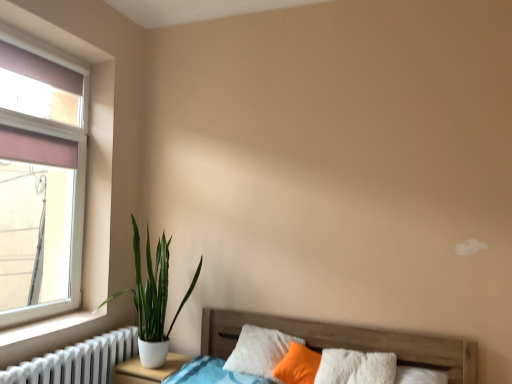
Where is `white ceramic plant at left`? This screenshot has width=512, height=384. white ceramic plant at left is located at coordinates (154, 300).

What are the coordinates of `white metallic radiator at lower left` in the screenshot? It's located at (77, 361).

What do you see at coordinates (347, 341) in the screenshot?
I see `wooden bed at lower left` at bounding box center [347, 341].

This screenshot has height=384, width=512. I want to click on wooden bed at lower left, so [347, 341].

What do you see at coordinates (46, 326) in the screenshot? The height and width of the screenshot is (384, 512). I see `white smooth window sill at lower left` at bounding box center [46, 326].

Where is `white ceramic plant at left`? The image size is (512, 384). white ceramic plant at left is located at coordinates (154, 300).

Is white metallic radiator at lower left oriented away from transparent glass window at left?

No.

Is white metallic radiator at lower left positioned behind transparent glass window at left?

That is False.

Based on the photo, how many degrees apart are the facing directions of white metallic radiator at lower left and transparent glass window at left?

white metallic radiator at lower left and transparent glass window at left are facing 88.9 degrees away from each other.

From a real-world perspective, is white metallic radiator at lower left positioned under transparent glass window at left based on gravity?

Indeed, from a real-world perspective, white metallic radiator at lower left is positioned beneath transparent glass window at left.

Considering the points (258, 365) and (7, 91), which point is in front, point (258, 365) or point (7, 91)?

The point (7, 91) is in front.

Can you confirm if white fluffy pillow at lower center is smaller than transparent glass window at left?

No, white fluffy pillow at lower center is not smaller than transparent glass window at left.

The width and height of the screenshot is (512, 384). In order to click on window above the white fluffy pillow at lower center (from a real-world perspective) in this screenshot , I will do `click(47, 165)`.

Considering the relative positions of white fluffy pillow at lower center and transparent glass window at left in the image provided, is white fluffy pillow at lower center to the left or to the right of transparent glass window at left?

Based on their positions, white fluffy pillow at lower center is located to the right of transparent glass window at left.

Consider the image. Can you confirm if white metallic radiator at lower left is positioned to the left of white smooth window sill at lower left?

No.

Looking at this image, is white metallic radiator at lower left behind white smooth window sill at lower left?

No, white metallic radiator at lower left is in front of white smooth window sill at lower left.

Considering the relative sizes of white metallic radiator at lower left and white smooth window sill at lower left in the image provided, is white metallic radiator at lower left wider than white smooth window sill at lower left?

Yes, white metallic radiator at lower left is wider than white smooth window sill at lower left.

In terms of size, does white matte nightstand at lower left appear bigger or smaller than transparent glass window at left?

Considering their sizes, white matte nightstand at lower left takes up more space than transparent glass window at left.

Considering the sizes of objects white matte nightstand at lower left and transparent glass window at left in the image provided, who is taller, white matte nightstand at lower left or transparent glass window at left?

transparent glass window at left is taller.

Considering the sizes of objects white matte nightstand at lower left and transparent glass window at left in the image provided, who is thinner, white matte nightstand at lower left or transparent glass window at left?

Thinner between the two is transparent glass window at left.

Is point (148, 383) closer to camera compared to point (13, 260)?

Yes, point (148, 383) is closer to viewer.

Which is behind, white fluffy pillow at lower center or white smooth window sill at lower left?

white fluffy pillow at lower center is more distant.

Can you tell me how much white fluffy pillow at lower center and white smooth window sill at lower left differ in facing direction?

white fluffy pillow at lower center and white smooth window sill at lower left are facing 68.4 degrees away from each other.

Identify the location of pillow on the right of white smooth window sill at lower left. (259, 351).

In the scene shown: Is white fluffy pillow at lower center wider than white smooth window sill at lower left?

Correct, the width of white fluffy pillow at lower center exceeds that of white smooth window sill at lower left.

Looking at this image, which object is wider, white matte nightstand at lower left or white metallic radiator at lower left?

white metallic radiator at lower left is wider.

From a real-world perspective, who is located higher, white matte nightstand at lower left or white metallic radiator at lower left?

white metallic radiator at lower left, from a real-world perspective.

Between white matte nightstand at lower left and white metallic radiator at lower left, which one appears on the right side from the viewer's perspective?

white matte nightstand at lower left.

Does white matte nightstand at lower left touch white metallic radiator at lower left?

No, white matte nightstand at lower left is not in contact with white metallic radiator at lower left.

Considering the sizes of objects white metallic radiator at lower left and wooden bed at lower left in the image provided, who is wider, white metallic radiator at lower left or wooden bed at lower left?

Wider between the two is wooden bed at lower left.

Is white metallic radiator at lower left in contact with wooden bed at lower left?

No.

What are the coordinates of `radiator in front of the transparent glass window at left` in the screenshot? It's located at (77, 361).

Identify the location of pillow that appears behind the transparent glass window at left. (259, 351).

From the image, which object appears to be farther from white metallic radiator at lower left, white fluffy pillow at lower center or wooden bed at lower left?

Based on the image, wooden bed at lower left appears to be further to white metallic radiator at lower left.

Based on their spatial positions, is white metallic radiator at lower left or white ceramic plant at left closer to white fluffy pillow at lower center?

white ceramic plant at left is positioned closer to the anchor white fluffy pillow at lower center.

Based on their spatial positions, is white metallic radiator at lower left or wooden bed at lower left closer to transparent glass window at left?

white metallic radiator at lower left.

Considering their positions, is white metallic radiator at lower left positioned closer to white fluffy pillow at lower center than white matte nightstand at lower left?

The object closer to white fluffy pillow at lower center is white matte nightstand at lower left.

When comparing their distances from white smooth window sill at lower left, does white ceramic plant at left or white metallic radiator at lower left seem closer?

The object closer to white smooth window sill at lower left is white metallic radiator at lower left.

Looking at the image, which one is located further to white matte nightstand at lower left, wooden bed at lower left or white fluffy pillow at lower center?

wooden bed at lower left is further to white matte nightstand at lower left.

Estimate the real-world distances between objects in this image. Which object is further from white smooth window sill at lower left, white fluffy pillow at lower center or white ceramic plant at left?

white fluffy pillow at lower center is further to white smooth window sill at lower left.

Estimate the real-world distances between objects in this image. Which object is further from white matte nightstand at lower left, white smooth window sill at lower left or white ceramic plant at left?

white smooth window sill at lower left is positioned further to the anchor white matte nightstand at lower left.

You are a GUI agent. You are given a task and a screenshot of the screen. Output one action in this format:
    pyautogui.click(x=<x>, y=<y>)
    Task: Click on the radiator located between wooden bed at lower left and white matte nightstand at lower left in the depth direction
    
    Given the screenshot: What is the action you would take?
    pyautogui.click(x=77, y=361)

Identify the location of houseplant between transparent glass window at left and white metallic radiator at lower left from top to bottom. (154, 300).

Locate an element on the screen. radiator located between white smooth window sill at lower left and white fluffy pillow at lower center in the left-right direction is located at coordinates (77, 361).

I want to click on window sill between transparent glass window at left and white metallic radiator at lower left in the vertical direction, so click(x=46, y=326).